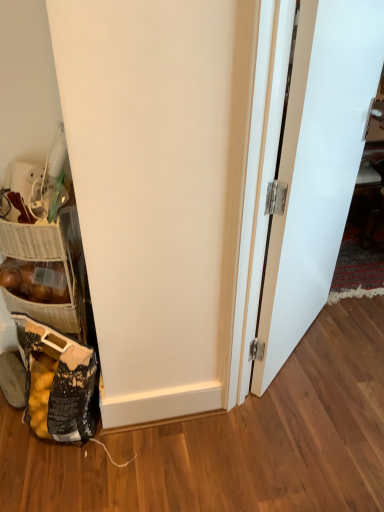
Identify the location of black plastic bag at lower left. This screenshot has height=512, width=384. (57, 382).

Locate an element on the screen. white matte door at right is located at coordinates coord(317,166).

Where is `woven brown basket at lower left`? The image size is (384, 512). woven brown basket at lower left is located at coordinates (35, 280).

This screenshot has height=512, width=384. I want to click on black plastic bag at lower left, so tap(57, 382).

Is white matte door at right outside of black plastic bag at lower left?

Indeed, white matte door at right is completely outside black plastic bag at lower left.

Between white matte door at right and black plastic bag at lower left, which one has smaller width?

white matte door at right is thinner.

Is white matte door at right smaller than black plastic bag at lower left?

Incorrect, white matte door at right is not smaller in size than black plastic bag at lower left.

Considering the positions of objects white matte door at right and black plastic bag at lower left in the image provided, who is behind, white matte door at right or black plastic bag at lower left?

black plastic bag at lower left is further from the camera.

Are woven brown basket at lower left and white matte door at right far apart?

They are positioned close to each other.

Considering the points (56, 292) and (290, 120), which point is behind, point (56, 292) or point (290, 120)?

The point (56, 292) is behind.

This screenshot has height=512, width=384. I want to click on stuff below the white matte door at right (from the image's perspective), so click(x=35, y=280).

From the picture: Could you tell me if woven brown basket at lower left is turned towards white matte door at right?

No, woven brown basket at lower left is not oriented towards white matte door at right.

Considering the sizes of objects woven brown basket at lower left and black plastic bag at lower left in the image provided, who is smaller, woven brown basket at lower left or black plastic bag at lower left?

woven brown basket at lower left.

Is woven brown basket at lower left inside or outside of black plastic bag at lower left?

woven brown basket at lower left is outside black plastic bag at lower left.

Considering the positions of objects woven brown basket at lower left and black plastic bag at lower left in the image provided, who is behind, woven brown basket at lower left or black plastic bag at lower left?

woven brown basket at lower left is further away from the camera.

Looking at this image, can you tell me how much woven brown basket at lower left and black plastic bag at lower left differ in facing direction?

46.9 degrees.

From the picture: Does black plastic bag at lower left turn towards white matte door at right?

No, black plastic bag at lower left is not aimed at white matte door at right.

Is there a large distance between black plastic bag at lower left and white matte door at right?

black plastic bag at lower left is actually quite close to white matte door at right.

From the image's perspective, which is below, black plastic bag at lower left or white matte door at right?

black plastic bag at lower left is shown below in the image.

Measure the distance from black plastic bag at lower left to white matte door at right.

They are 35.14 inches apart.

Considering the relative sizes of white matte door at right and woven brown basket at lower left in the image provided, is white matte door at right bigger than woven brown basket at lower left?

Yes.

Which object is more forward, white matte door at right or woven brown basket at lower left?

white matte door at right is more forward.

Between white matte door at right and woven brown basket at lower left, which one has more height?

white matte door at right is taller.

Can you tell me how much black plastic bag at lower left and woven brown basket at lower left differ in facing direction?

46.9 degrees.

From the image's perspective, between black plastic bag at lower left and woven brown basket at lower left, which one is located above?

woven brown basket at lower left is shown above in the image.

Could you tell me if black plastic bag at lower left is facing woven brown basket at lower left?

No, black plastic bag at lower left is not turned towards woven brown basket at lower left.

Where is `material lying below the white matte door at right (from the image's perspective)`? The height and width of the screenshot is (512, 384). material lying below the white matte door at right (from the image's perspective) is located at coordinates (57, 382).

You are a GUI agent. You are given a task and a screenshot of the screen. Output one action in this format:
    pyautogui.click(x=<x>, y=<y>)
    Task: Click on the stuff that appears behind the white matte door at right
    
    Given the screenshot: What is the action you would take?
    pyautogui.click(x=35, y=280)

Based on their spatial positions, is white matte door at right or black plastic bag at lower left closer to woven brown basket at lower left?

black plastic bag at lower left.

From the image, which object appears to be nearer to black plastic bag at lower left, white matte door at right or woven brown basket at lower left?

Based on the image, woven brown basket at lower left appears to be nearer to black plastic bag at lower left.

When comparing their distances from white matte door at right, does black plastic bag at lower left or woven brown basket at lower left seem further?

Among the two, woven brown basket at lower left is located further to white matte door at right.

When comparing their distances from black plastic bag at lower left, does woven brown basket at lower left or white matte door at right seem closer?

woven brown basket at lower left lies closer to black plastic bag at lower left than the other object.

Considering their positions, is black plastic bag at lower left positioned further to woven brown basket at lower left than white matte door at right?

white matte door at right is positioned further to the anchor woven brown basket at lower left.

Considering their positions, is woven brown basket at lower left positioned further to white matte door at right than black plastic bag at lower left?

woven brown basket at lower left.

Where is `material situated between woven brown basket at lower left and white matte door at right from left to right`? material situated between woven brown basket at lower left and white matte door at right from left to right is located at coordinates (57, 382).